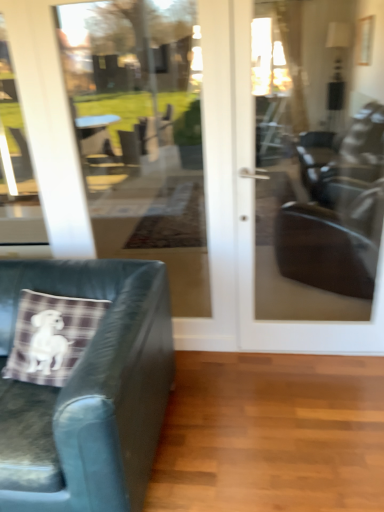
You are a GUI agent. You are given a task and a screenshot of the screen. Output one action in this format:
    pyautogui.click(x=<x>, y=<y>)
    Task: Click on the vacant region under matte glass door at center (from a real-world perspective)
    
    Given the screenshot: What is the action you would take?
    pyautogui.click(x=312, y=354)